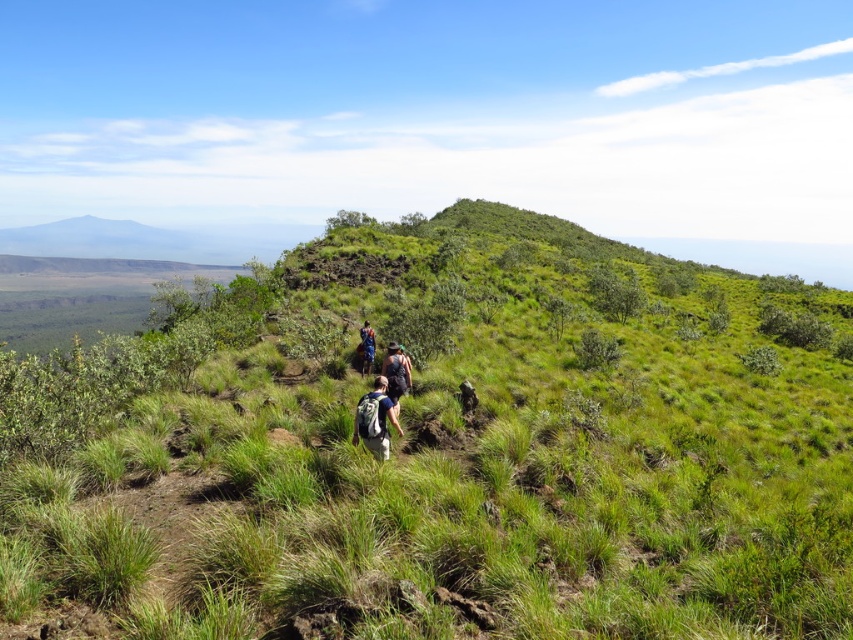
Measure the distance between dark blue backpack at center and camera.

The distance of dark blue backpack at center from camera is 14.98 meters.

From the picture: Between dark blue backpack at center and blue fabric backpack at center, which one is positioned higher?

blue fabric backpack at center

Image resolution: width=853 pixels, height=640 pixels. Describe the element at coordinates (395, 372) in the screenshot. I see `dark blue backpack at center` at that location.

Locate an element on the screen. The width and height of the screenshot is (853, 640). dark blue backpack at center is located at coordinates (395, 372).

Is matte blue backpack at center wider than dark blue backpack at center?

Yes.

Is matte blue backpack at center above dark blue backpack at center?

No.

This screenshot has width=853, height=640. I want to click on matte blue backpack at center, so click(375, 419).

Image resolution: width=853 pixels, height=640 pixels. I want to click on matte blue backpack at center, so click(375, 419).

Can you confirm if green grassy at center is positioned to the right of dark blue backpack at center?

Indeed, green grassy at center is positioned on the right side of dark blue backpack at center.

Is point (833, 476) positioned after point (395, 385)?

That is True.

The height and width of the screenshot is (640, 853). Identify the location of green grassy at center. (442, 449).